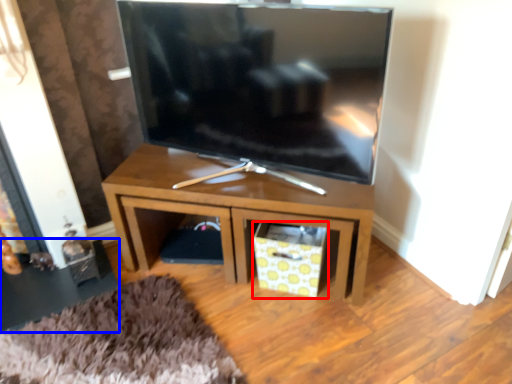
Question: Which object appears closest to the camera in this image, drawer (highlighted by a red box) or side table (highlighted by a blue box)?

Choices:
 (A) drawer
 (B) side table

Answer: (A)